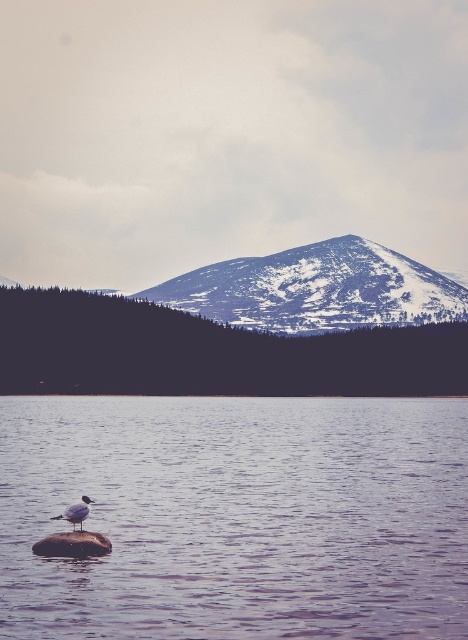
Question: Among these objects, which one is farthest from the camera?

Choices:
 (A) snowy rock formation at center
 (B) white matte bird at lower left
 (C) brown rough stone at lower left

Answer: (A)

Question: Does brown rough stone at lower left appear over white matte bird at lower left?

Choices:
 (A) no
 (B) yes

Answer: (A)

Question: Is smooth water at center wider than white matte bird at lower left?

Choices:
 (A) no
 (B) yes

Answer: (B)

Question: Which point appears farthest from the camera in this image?

Choices:
 (A) (322, 448)
 (B) (35, 548)
 (C) (273, 298)
 (D) (70, 513)

Answer: (C)

Question: Can you confirm if brown rough stone at lower left is positioned to the right of white matte bird at lower left?

Choices:
 (A) no
 (B) yes

Answer: (B)

Question: Among these objects, which one is farthest from the camera?

Choices:
 (A) snowy rock formation at center
 (B) brown rough stone at lower left
 (C) white matte bird at lower left
 (D) smooth water at center

Answer: (A)